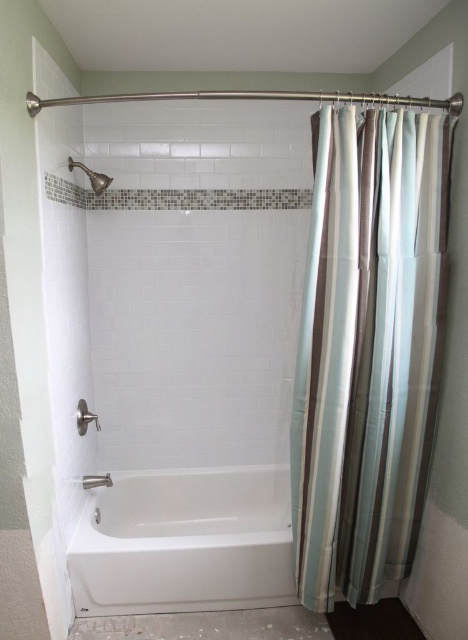
Does striped fabric shower curtain at right have a lesser height compared to brushed metal showerhead at upper left?

No, striped fabric shower curtain at right is not shorter than brushed metal showerhead at upper left.

Is striped fabric shower curtain at right taller than brushed metal showerhead at upper left?

Yes.

You are a GUI agent. You are given a task and a screenshot of the screen. Output one action in this format:
    pyautogui.click(x=<x>, y=<y>)
    Task: Click on the striped fabric shower curtain at right
    
    Given the screenshot: What is the action you would take?
    pyautogui.click(x=367, y=348)

Which is in front, point (151, 611) or point (102, 186)?

Positioned in front is point (151, 611).

Who is shorter, white glossy bathtub at center or brushed metal showerhead at upper left?

brushed metal showerhead at upper left

Find the location of `white glossy bathtub at center`. white glossy bathtub at center is located at coordinates (184, 541).

In the scene shown: Does striped fabric shower curtain at right appear under white glossy bathtub at center?

Incorrect, striped fabric shower curtain at right is not positioned below white glossy bathtub at center.

Is point (343, 436) positioned before point (190, 570)?

Yes.

Measure the distance between point (430,161) and camera.

The distance of point (430,161) from camera is 5.50 feet.

Find the location of a particular element. The height and width of the screenshot is (640, 468). striped fabric shower curtain at right is located at coordinates (367, 348).